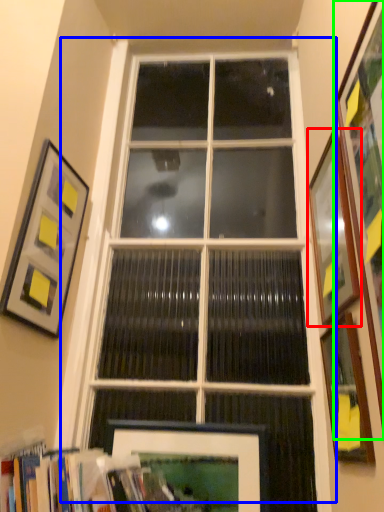
Question: Considering the real-world distances, which object is closest to picture frame (highlighted by a red box)? window (highlighted by a blue box) or picture frame (highlighted by a green box).

Choices:
 (A) window
 (B) picture frame

Answer: (B)